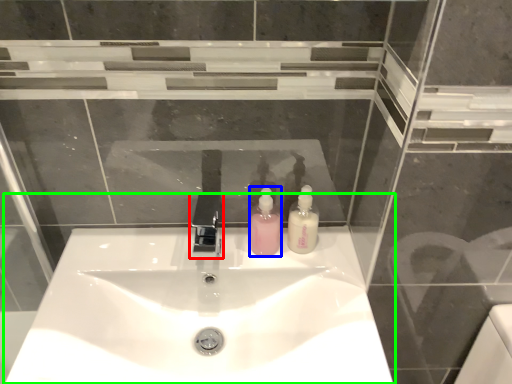
Question: Which object is the farthest from tap (highlighted by a red box)? Choose among these: soap dispenser (highlighted by a blue box) or sink (highlighted by a green box).

Choices:
 (A) soap dispenser
 (B) sink

Answer: (B)